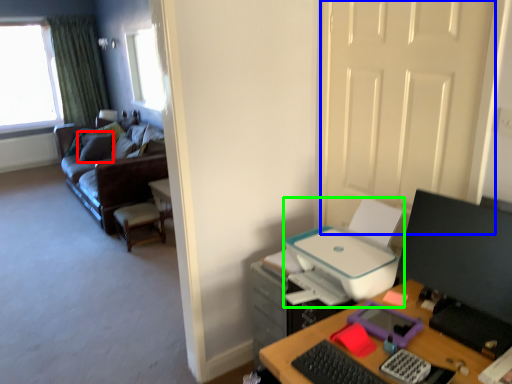
Question: Which object is positioned closest to pillow (highlighted by a red box)? Select from door (highlighted by a blue box) and printer (highlighted by a green box).

Choices:
 (A) door
 (B) printer

Answer: (B)